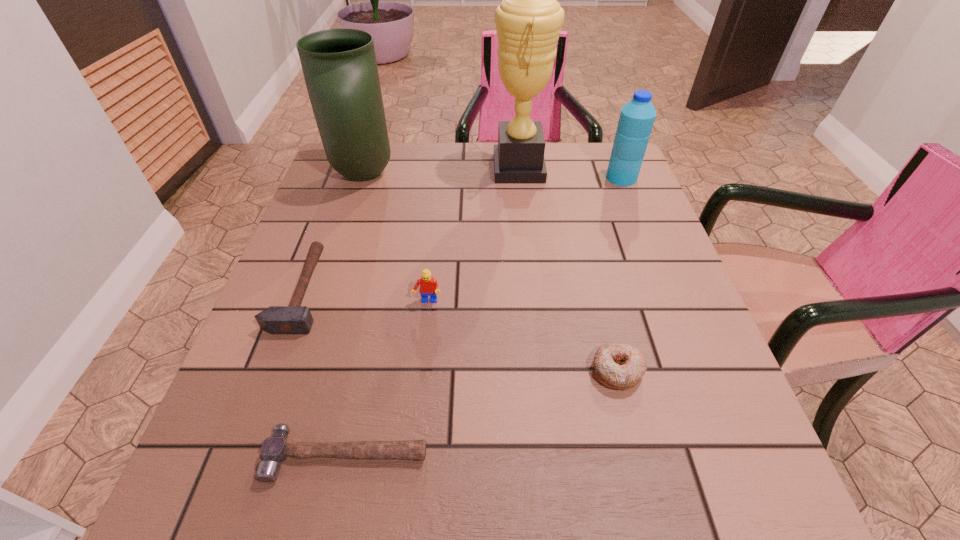
Locate an element on the screen. This screenshot has width=960, height=540. free spot between the taller hammer and the vase is located at coordinates (332, 232).

Image resolution: width=960 pixels, height=540 pixels. Identify the location of empty location between the fifth object from left to right and the Lego. (473, 235).

Locate an element on the screen. empty space between the second tallest object and the sixth object from left to right is located at coordinates (491, 272).

Where is `free space that is in between the farther hammer and the water bottle`? The height and width of the screenshot is (540, 960). free space that is in between the farther hammer and the water bottle is located at coordinates (462, 234).

Where is `empty location between the tallest object and the nearer hammer`? Image resolution: width=960 pixels, height=540 pixels. empty location between the tallest object and the nearer hammer is located at coordinates (433, 312).

Image resolution: width=960 pixels, height=540 pixels. Identify the location of blank region between the second nearest object and the vase. (491, 272).

Select which object appears as the sixth closest to the taller hammer. Please provide its 2D coordinates. Your answer should be formatted as a tuple, i.e. [(x, y)], where the tuple contains the x and y coordinates of a point satisfying the conditions above.

[(637, 116)]

Choose which object is the nearest neighbor to the taller hammer. Please provide its 2D coordinates. Your answer should be formatted as a tuple, i.e. [(x, y)], where the tuple contains the x and y coordinates of a point satisfying the conditions above.

[(275, 449)]

The width and height of the screenshot is (960, 540). Identify the location of vacant space that satisfies the following two spatial constraints: 1. on the front-facing side of the fourth tallest object; 2. on the left side of the doughnut. (420, 370).

Locate an element on the screen. vacant space that satisfies the following two spatial constraints: 1. at the front of the second object from right to left with handles; 2. on the left side of the tallest object is located at coordinates (541, 370).